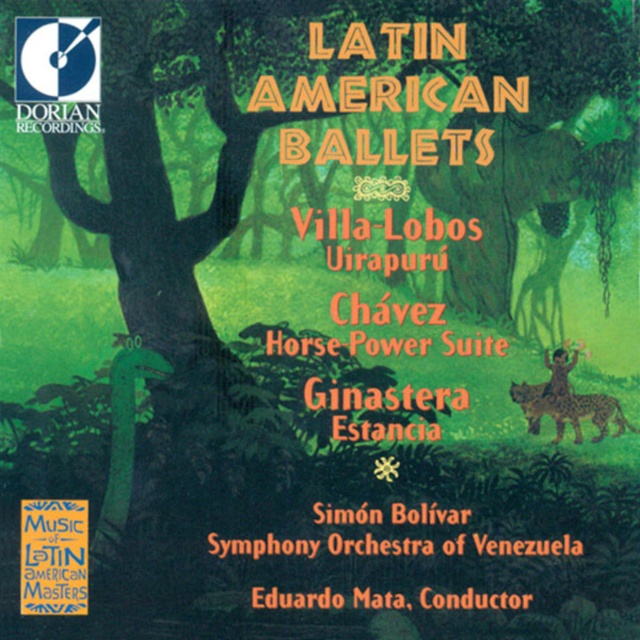
Is point (582, 404) positioned before point (552, 392)?

Yes, it is.

Is spotted fur hyena at center smaller than brown fur jaguar at upper right?

Actually, spotted fur hyena at center might be larger than brown fur jaguar at upper right.

Does point (572, 397) come farther from viewer compared to point (561, 390)?

That is True.

I want to click on spotted fur hyena at center, so (x=568, y=410).